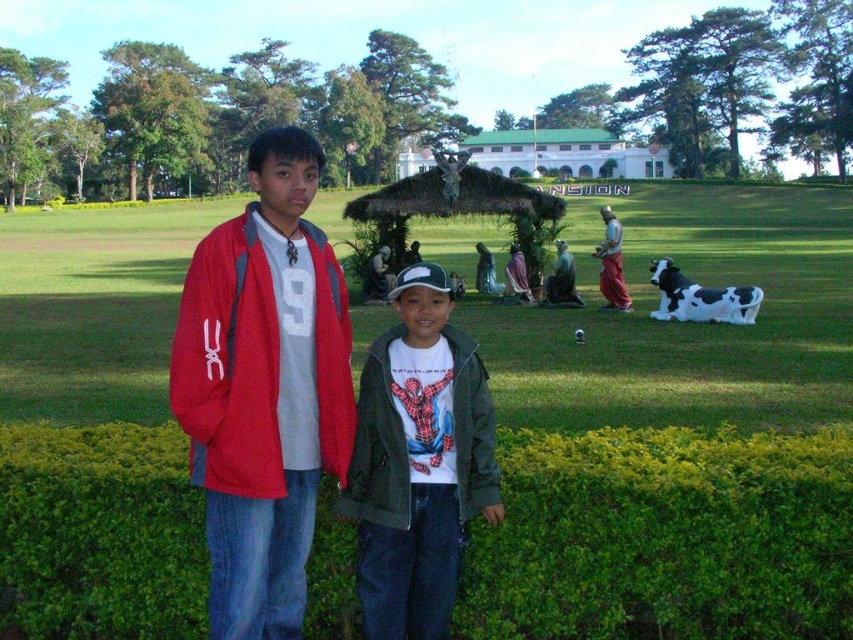
Can you confirm if green textured jacket at center is bigger than matte brown statue at center-right?

No, green textured jacket at center is not bigger than matte brown statue at center-right.

Does green textured jacket at center lie in front of matte brown statue at center-right?

That is True.

Between point (422, 438) and point (624, 300), which one is positioned behind?

The point (624, 300) is more distant.

Identify the location of green textured jacket at center. This screenshot has width=853, height=640. click(418, 461).

You are a GUI agent. You are given a task and a screenshot of the screen. Output one action in this format:
    pyautogui.click(x=<x>, y=<y>)
    Task: Click on the matte red jacket at center
    This screenshot has width=853, height=640.
    Given the screenshot: What is the action you would take?
    pyautogui.click(x=670, y=428)

Is matte red jacket at center smaller than green marble statue at center?

Actually, matte red jacket at center might be larger than green marble statue at center.

Is point (190, 241) less distant than point (556, 252)?

No.

I want to click on matte red jacket at center, so click(670, 428).

Can you confirm if matte brown statue at center-right is smaller than green marble statue at center?

No.

From the picture: Is matte brown statue at center-right in front of green marble statue at center?

Yes, matte brown statue at center-right is closer to the viewer.

Is point (613, 218) positioned after point (546, 284)?

No, (613, 218) is closer to viewer.

Image resolution: width=853 pixels, height=640 pixels. What are the coordinates of `matte brown statue at center-right` in the screenshot? It's located at (611, 262).